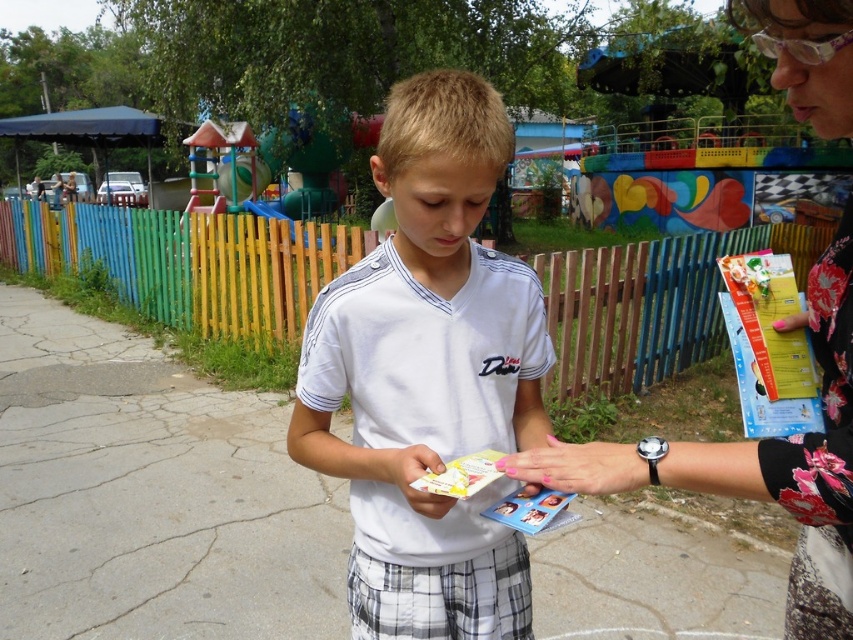
Consider the image. Which is more to the right, pink painted nails at center or white matte paper at center?

From the viewer's perspective, pink painted nails at center appears more on the right side.

Which is more to the left, pink painted nails at center or white matte paper at center?

From the viewer's perspective, white matte paper at center appears more on the left side.

Which is behind, point (537, 451) or point (402, 474)?

The point (402, 474) is behind.

At what (x,y) coordinates should I click in order to perform the action: click on pink painted nails at center. Please return your answer as a coordinate pair (x, y). Image resolution: width=853 pixels, height=640 pixels. Looking at the image, I should click on pos(579,467).

Is floral fabric wristwatch at center to the right of white matte paper at center from the viewer's perspective?

Correct, you'll find floral fabric wristwatch at center to the right of white matte paper at center.

Does point (715, 461) lie in front of point (422, 492)?

Yes, point (715, 461) is closer to viewer.

Find the location of `floral fabric wristwatch at center`. floral fabric wristwatch at center is located at coordinates (798, 458).

Which is below, white cotton shirt at center or pink painted nails at center?

pink painted nails at center is lower down.

What are the coordinates of `white cotton shirt at center` in the screenshot? It's located at (428, 372).